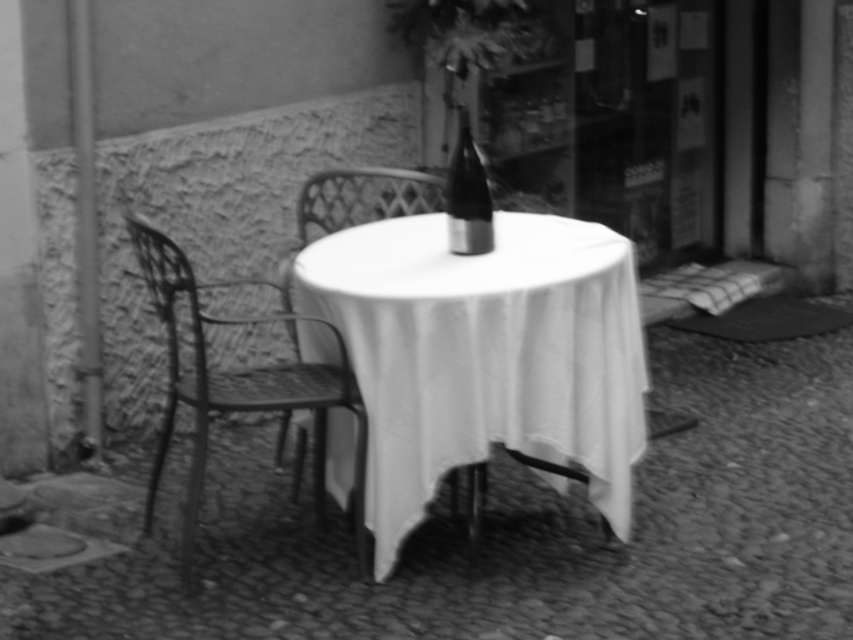
You are setting up a small outdoor event and need to place two chairs next to the round table. The metallic wire chair at left and the metallic mesh chair at center are available. Which chair has a larger size that might be more comfortable for guests?

The metallic wire chair at left is bigger than the metallic mesh chair at center, so it might be more comfortable for guests due to its larger size.